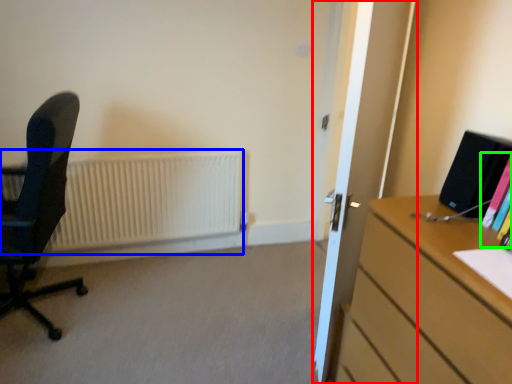
Question: Which object is positioned farthest from glass door (highlighted by a red box)? Select from radiator (highlighted by a blue box) and book (highlighted by a green box).

Choices:
 (A) radiator
 (B) book

Answer: (A)